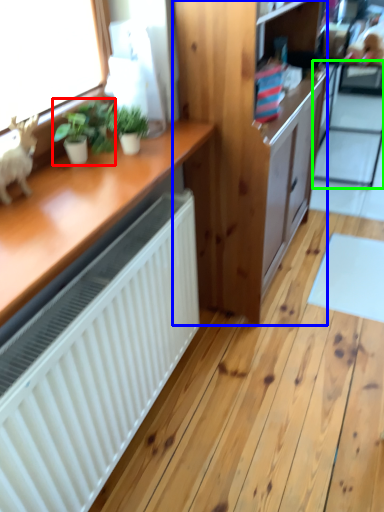
Question: Which is nearer to the houseplant (highlighted by a red box)? cabinetry (highlighted by a blue box) or screen door (highlighted by a green box).

Choices:
 (A) cabinetry
 (B) screen door

Answer: (A)